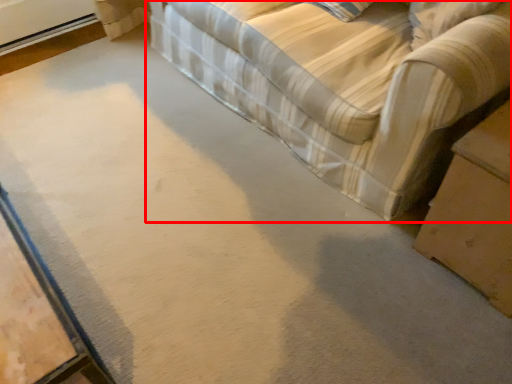
Question: In this image, where is studio couch (annotated by the red box) located relative to table?

Choices:
 (A) left
 (B) right

Answer: (A)